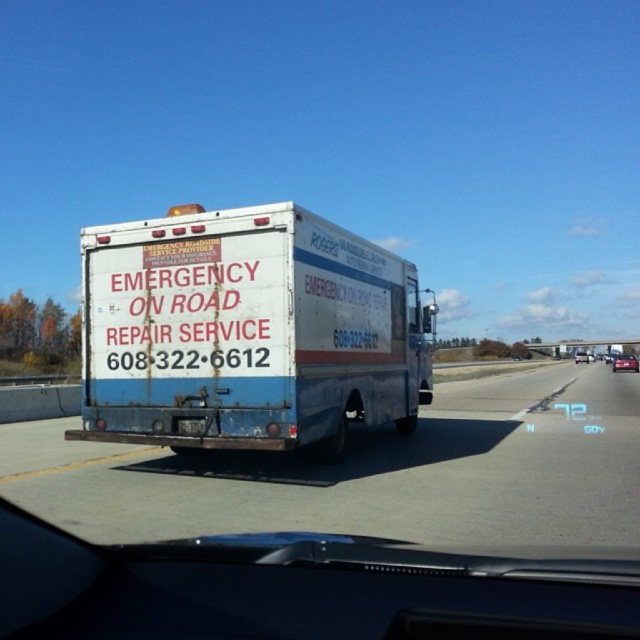
You are driving a car and see the white matte truck at center and the metallic red sedan at center on the highway. Which vehicle is positioned to the left of the other?

The white matte truck at center is to the left of the metallic red sedan at center.

You are a delivery driver who needs to pass through the area between the rusty metal truck at center and the black metal license plate at center. Your truck is 5.5 meters long. Can you safely pass through this space?

The distance between the rusty metal truck at center and the black metal license plate at center is 5.70 meters. Since your truck is 5.5 meters long, there is enough space to safely pass through.